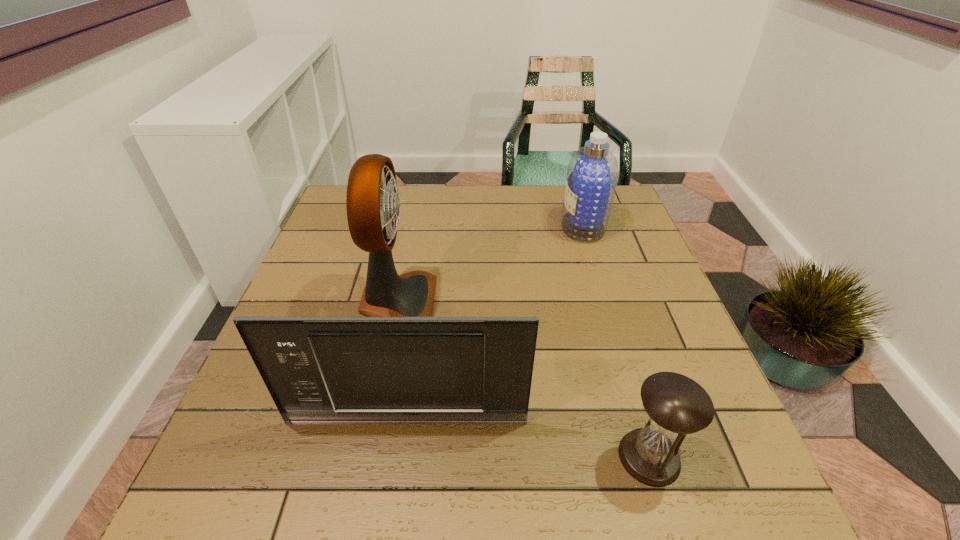
Where is `free space that satisfies the following two spatial constraints: 1. on the back side of the shortest object; 2. on the front-facing side of the fan`? free space that satisfies the following two spatial constraints: 1. on the back side of the shortest object; 2. on the front-facing side of the fan is located at coordinates (603, 301).